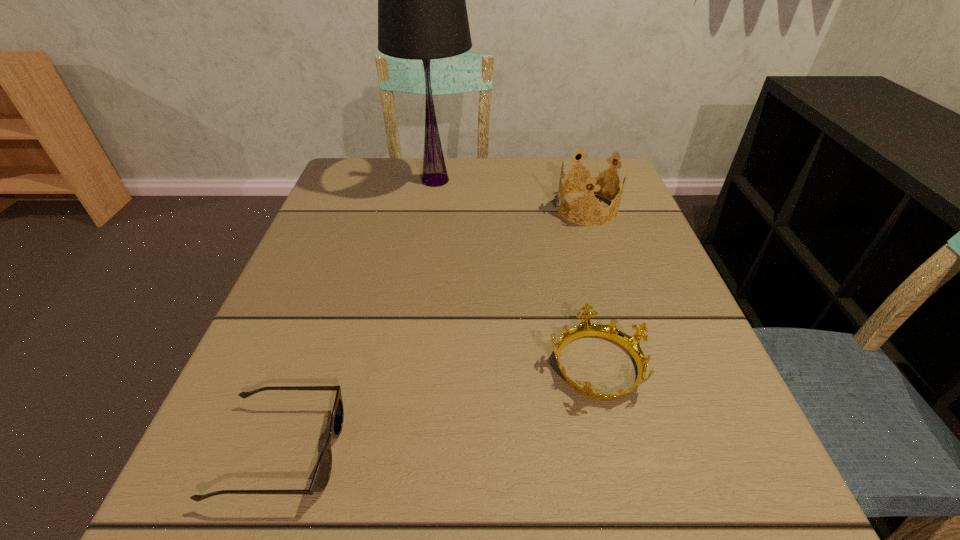
The height and width of the screenshot is (540, 960). I want to click on free spot at the left edge of the desktop, so coord(333,233).

The height and width of the screenshot is (540, 960). I want to click on vacant space at the right edge of the desktop, so click(x=681, y=299).

Identify the location of free location at the far left corner. This screenshot has height=540, width=960. (337, 176).

The width and height of the screenshot is (960, 540). I want to click on free space at the near left corner of the desktop, so click(252, 471).

This screenshot has height=540, width=960. Identify the location of vacant space at the near right corner. (643, 466).

This screenshot has height=540, width=960. I want to click on free space between the farther crown and the shortest object, so click(434, 330).

Where is `unoccupied position between the second shortest object and the farther crown`? unoccupied position between the second shortest object and the farther crown is located at coordinates (591, 286).

I want to click on empty space that is in between the tallest object and the shorter crown, so click(x=516, y=272).

Identify the location of empty space that is in between the farther crown and the sunglasses. The width and height of the screenshot is (960, 540). (434, 330).

Identify the location of vacant point located between the sunglasses and the shorter crown. This screenshot has width=960, height=540. (439, 408).